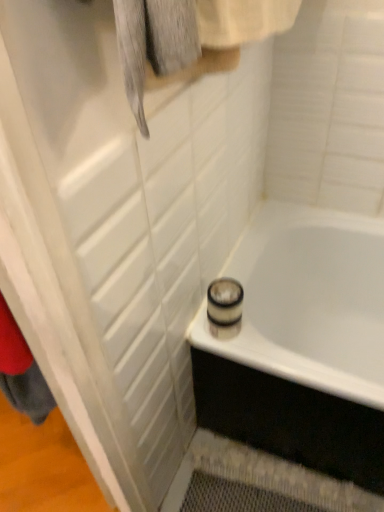
This screenshot has width=384, height=512. Describe the element at coordinates (308, 301) in the screenshot. I see `white glossy bathtub at lower right` at that location.

What is the approximate width of white glossy bathtub at lower right?

The width of white glossy bathtub at lower right is 24.93 inches.

Where is `white glossy bathtub at lower right`? The image size is (384, 512). white glossy bathtub at lower right is located at coordinates (308, 301).

The image size is (384, 512). Find the location of `white glossy bathtub at lower right`. white glossy bathtub at lower right is located at coordinates (308, 301).